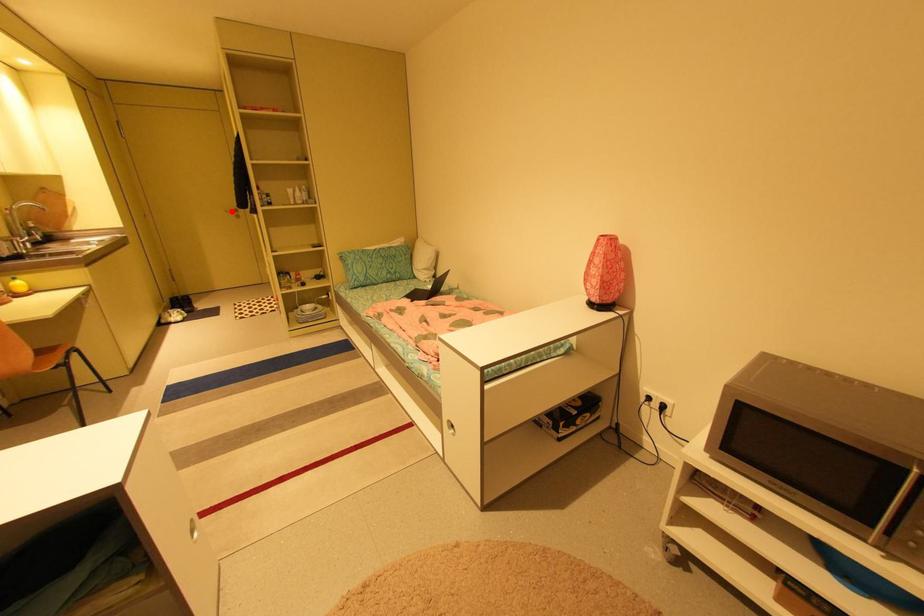
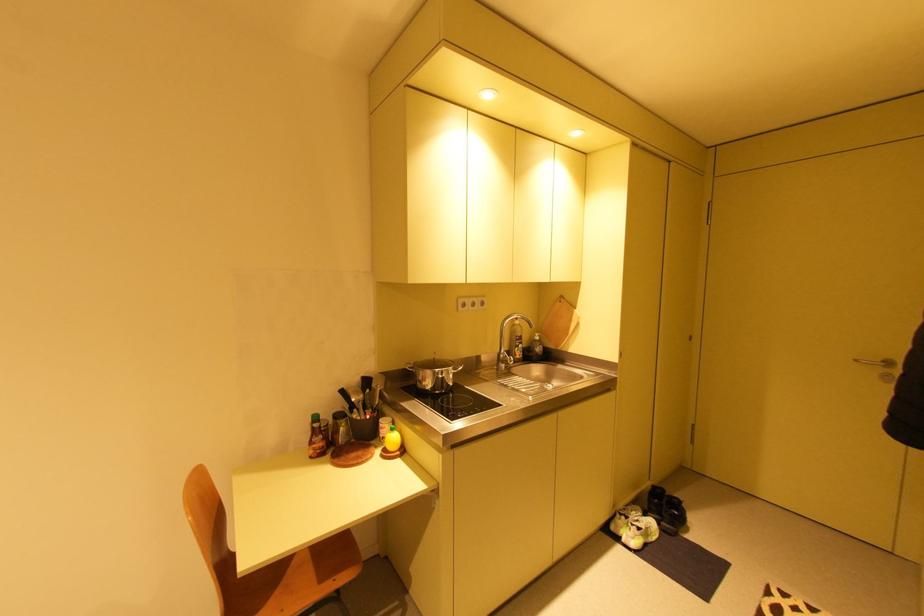
Locate, in the second image, the point that corresponds to the highlighted location in the first image.

(861, 361)